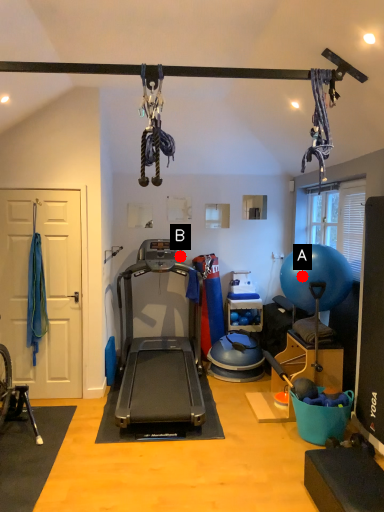
Question: Two points are circled on the image, labeled by A and B beside each circle. Which of the following is the farthest from the observer?

Choices:
 (A) A is further
 (B) B is further

Answer: (B)